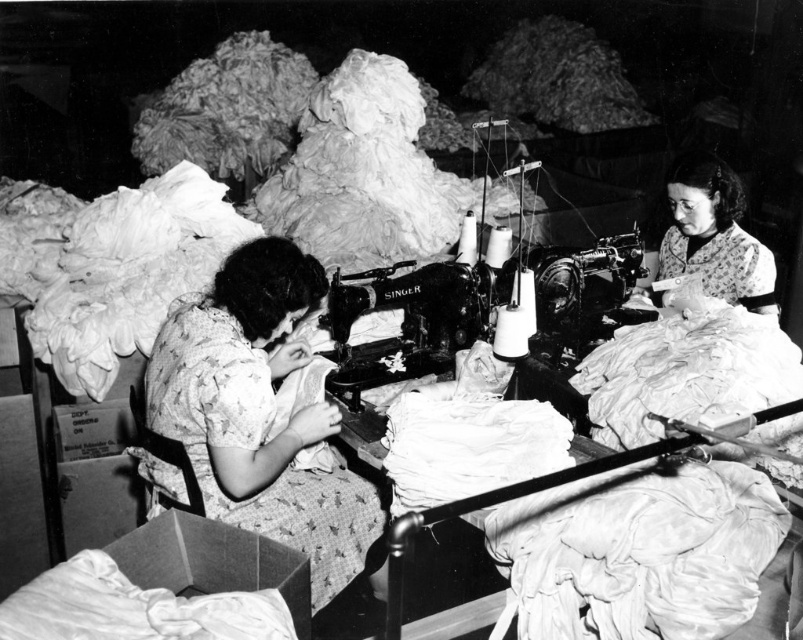
You are an observer in the sewing room and need to determine which of the two floral fabric dresses is wider. The dresses are the floral fabric dress at center and the floral fabric dress at upper right. Which one is wider?

The floral fabric dress at center is wider than the floral fabric dress at upper right.

You are a delivery person who needs to place a 3.5 feet long box between the floral fabric dress at center and the floral fabric dress at upper right. Can you fit the box in the space between them?

The distance between the floral fabric dress at center and the floral fabric dress at upper right is 5.69 feet. Since the box is 3.5 feet long, it can be placed in the space between them as there is enough room.